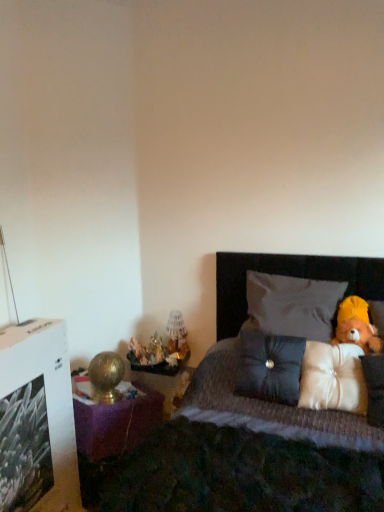
Question: Could you tell me if matte glass table lamp at center is turned towards satin dark gray pillow at center, the 2th pillow from the bottom?

Choices:
 (A) yes
 (B) no

Answer: (B)

Question: Considering the relative sizes of matte glass table lamp at center and satin dark gray pillow at center, the 2th pillow from the bottom, in the image provided, is matte glass table lamp at center bigger than satin dark gray pillow at center, the 2th pillow from the bottom,?

Choices:
 (A) yes
 (B) no

Answer: (B)

Question: Is matte glass table lamp at center outside of satin dark gray pillow at center, the 2th pillow from the bottom?

Choices:
 (A) yes
 (B) no

Answer: (A)

Question: Considering the relative sizes of matte glass table lamp at center and satin dark gray pillow at center, the second pillow when ordered from top to bottom, in the image provided, is matte glass table lamp at center taller than satin dark gray pillow at center, the second pillow when ordered from top to bottom,?

Choices:
 (A) no
 (B) yes

Answer: (A)

Question: From the image's perspective, is matte glass table lamp at center located above satin dark gray pillow at center, the 2th pillow from the bottom?

Choices:
 (A) no
 (B) yes

Answer: (B)

Question: Can you confirm if matte glass table lamp at center is thinner than satin dark gray pillow at center, the 2th pillow from the bottom?

Choices:
 (A) no
 (B) yes

Answer: (B)

Question: From a real-world perspective, does metallic gold figurines at left sit lower than satin white pillow at right, which ranks as the 1th pillow in bottom-to-top order?

Choices:
 (A) yes
 (B) no

Answer: (A)

Question: Considering the relative sizes of metallic gold figurines at left and satin white pillow at right, which ranks as the 1th pillow in bottom-to-top order, in the image provided, is metallic gold figurines at left shorter than satin white pillow at right, which ranks as the 1th pillow in bottom-to-top order,?

Choices:
 (A) yes
 (B) no

Answer: (A)

Question: Is metallic gold figurines at left next to satin white pillow at right, acting as the third pillow starting from the top?

Choices:
 (A) yes
 (B) no

Answer: (B)

Question: Is metallic gold figurines at left aimed at satin white pillow at right, which ranks as the 1th pillow in bottom-to-top order?

Choices:
 (A) yes
 (B) no

Answer: (B)

Question: Does metallic gold figurines at left have a greater height compared to satin white pillow at right, which ranks as the 1th pillow in bottom-to-top order?

Choices:
 (A) yes
 (B) no

Answer: (B)

Question: Is the depth of metallic gold figurines at left greater than that of satin white pillow at right, acting as the third pillow starting from the top?

Choices:
 (A) no
 (B) yes

Answer: (B)

Question: Is dark fabric bed at right touching white fabric pillow at upper right, which is the 3th pillow in bottom-to-top order?

Choices:
 (A) no
 (B) yes

Answer: (A)